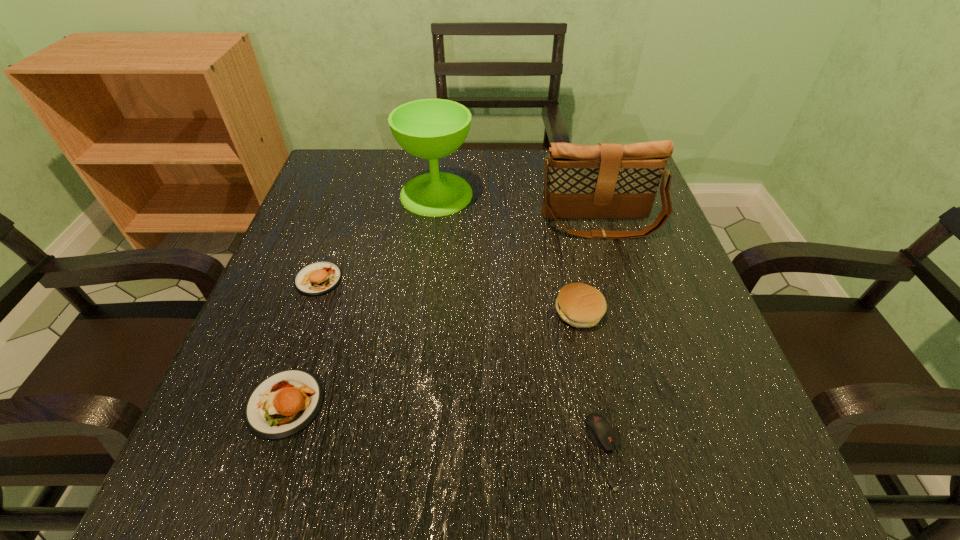
I want to click on free location at the far left corner, so click(323, 185).

In the image, there is a desktop. At what (x,y) coordinates should I click in order to perform the action: click on vacant space at the near right corner. Please return your answer as a coordinate pair (x, y). Looking at the image, I should click on (762, 490).

Find the location of `blank region between the mouse and the second shortest object`. blank region between the mouse and the second shortest object is located at coordinates tap(445, 428).

The width and height of the screenshot is (960, 540). Identify the location of unoccupied position between the fourth object from right to left and the rightmost patty (food). (508, 253).

Identify the location of vacant area between the third object from left to right and the nearest patty (food). The width and height of the screenshot is (960, 540). (361, 299).

At what (x,y) coordinates should I click in order to perform the action: click on vacant space that is in between the shoulder bag and the shortest patty (food). Please return your answer as a coordinate pair (x, y). This screenshot has height=540, width=960. Looking at the image, I should click on (443, 313).

At what (x,y) coordinates should I click in order to perform the action: click on free space between the shortest patty (food) and the rightmost patty (food). Please return your answer as a coordinate pair (x, y). The height and width of the screenshot is (540, 960). Looking at the image, I should click on (432, 357).

Locate an element on the screen. The width and height of the screenshot is (960, 540). free space between the fifth tallest object and the third object from left to right is located at coordinates (361, 299).

Find the location of a particular element. The width and height of the screenshot is (960, 540). empty space between the second shortest object and the mouse is located at coordinates (445, 428).

I want to click on vacant space in between the shoulder bag and the fifth tallest object, so click(443, 313).